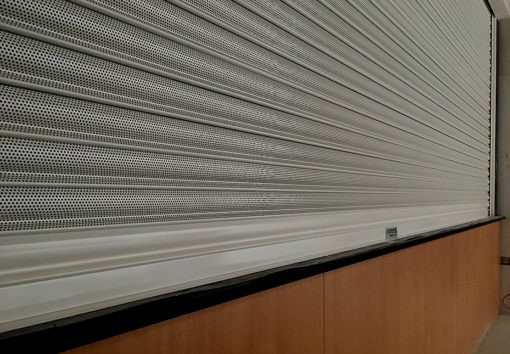
Locate an element on the screen. panels is located at coordinates (303, 314), (447, 301).